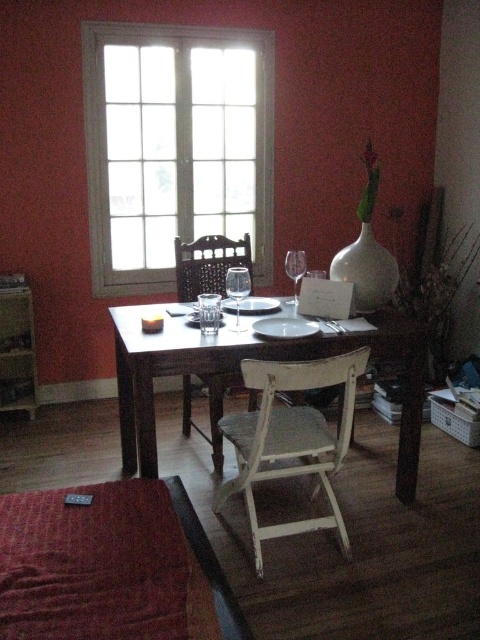
Question: Among these objects, which one is farthest from the camera?

Choices:
 (A) woven wood chair at center
 (B) transparent glass wine glass at center
 (C) transparent glass wine glass at table center
 (D) wooden table at center

Answer: (B)

Question: Does clear glass window at upper center appear under woven wood chair at center?

Choices:
 (A) yes
 (B) no

Answer: (B)

Question: Is clear glass window at upper center closer to the viewer compared to wooden table at center?

Choices:
 (A) yes
 (B) no

Answer: (B)

Question: Where is white wood chair at center located in relation to transparent glass wine glass at center in the image?

Choices:
 (A) right
 (B) left

Answer: (B)

Question: Based on their relative distances, which object is farther from the white wood chair at center?

Choices:
 (A) clear glass window at upper center
 (B) woven wood chair at center

Answer: (A)

Question: Among these points, which one is farthest from the camera?

Choices:
 (A) (147, 465)
 (B) (238, 276)
 (C) (319, 442)

Answer: (B)